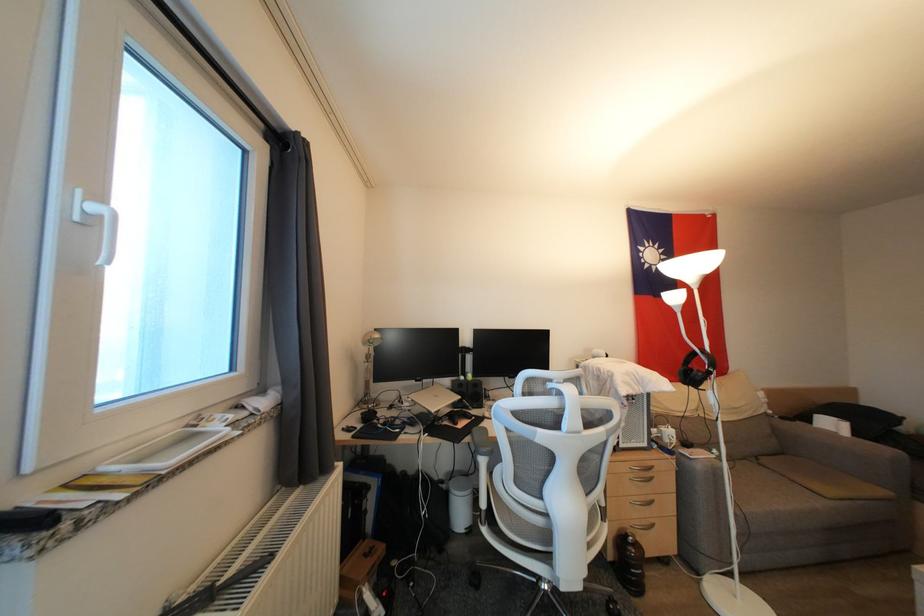
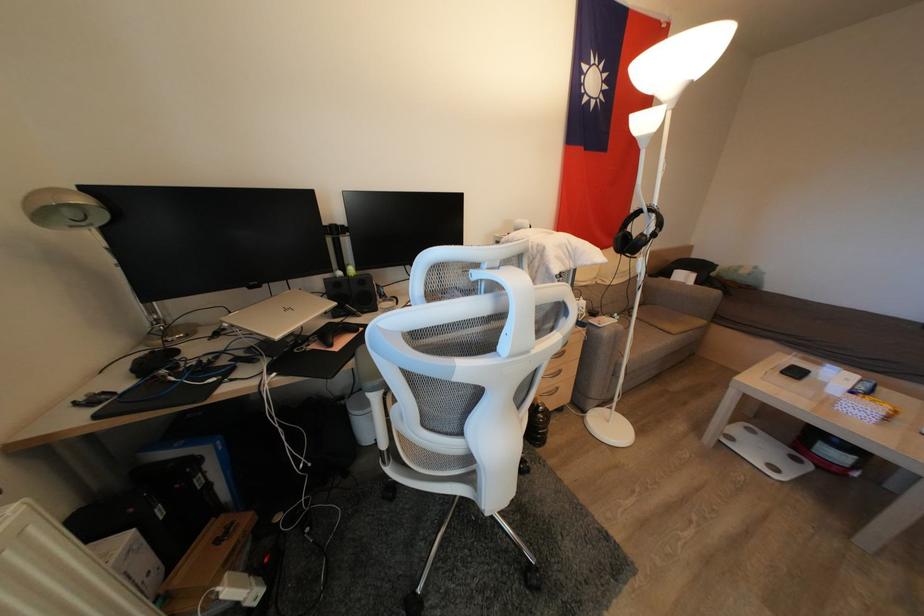
How did the camera likely rotate?

The camera rotated toward right-down.